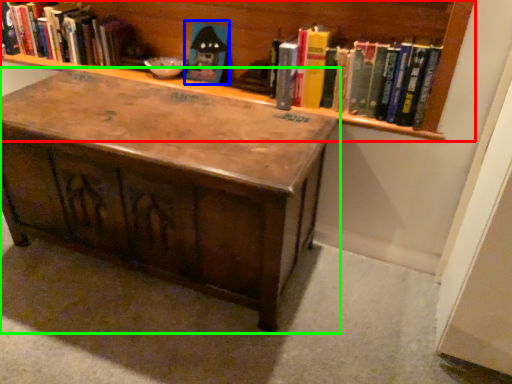
Question: Which is farther away from bookcase (highlighted by a red box)? toy (highlighted by a blue box) or table (highlighted by a green box)?

Choices:
 (A) toy
 (B) table

Answer: (B)